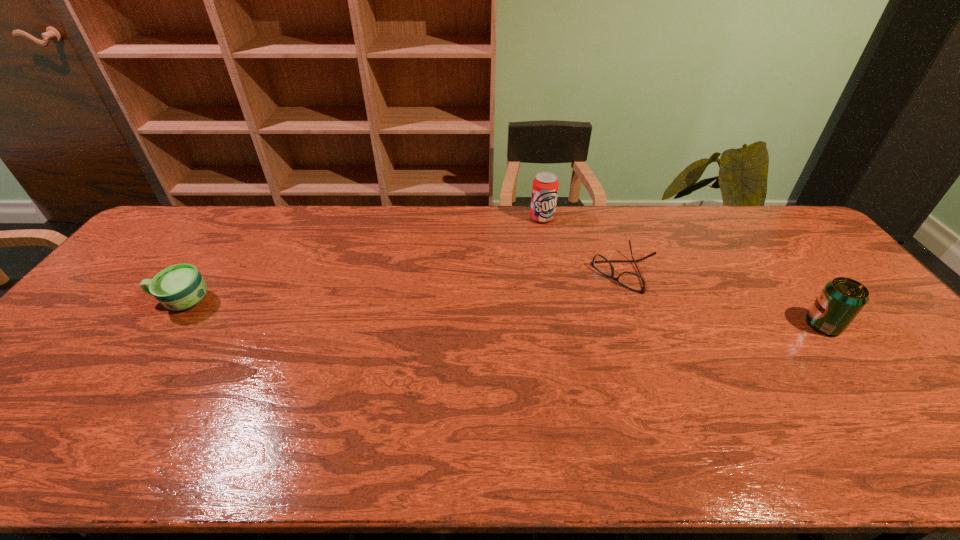
This screenshot has height=540, width=960. In the image, there is a desktop. In order to click on vacant region at the left edge in this screenshot , I will do `click(51, 356)`.

Locate an element on the screen. This screenshot has width=960, height=540. vacant space at the far left corner of the desktop is located at coordinates (183, 223).

Locate an element on the screen. free space between the spectacles and the rightmost object is located at coordinates (724, 299).

At what (x,y) coordinates should I click in order to perform the action: click on free space between the second tallest object and the spectacles. Please return your answer as a coordinate pair (x, y). This screenshot has height=540, width=960. Looking at the image, I should click on (724, 299).

This screenshot has width=960, height=540. Find the location of `free space between the farthest object and the spectacles`. free space between the farthest object and the spectacles is located at coordinates (584, 245).

I want to click on vacant area between the second object from right to left and the rightmost object, so pos(724,299).

Find the location of a particular element. The height and width of the screenshot is (540, 960). free space between the cup and the third shortest object is located at coordinates (502, 313).

The image size is (960, 540). I want to click on free area in between the farthest object and the second shortest object, so click(x=362, y=260).

Image resolution: width=960 pixels, height=540 pixels. I want to click on vacant point located between the spectacles and the beer can, so click(724, 299).

The image size is (960, 540). Identify the location of empty space between the second object from right to left and the second shortest object. (403, 287).